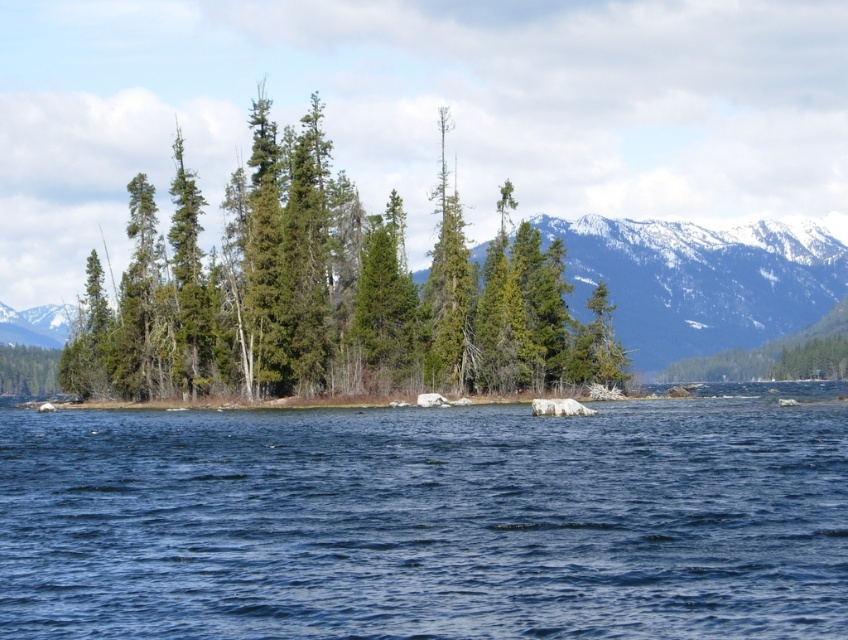
Question: Is snowy rocky mountain at center to the right of snowy white mountain at left from the viewer's perspective?

Choices:
 (A) no
 (B) yes

Answer: (B)

Question: Is blue liquid water at center to the right of green matte trees at center from the viewer's perspective?

Choices:
 (A) yes
 (B) no

Answer: (A)

Question: Estimate the real-world distances between objects in this image. Which object is farther from the green matte tree at left?

Choices:
 (A) green matte trees at center
 (B) snowy white mountain at left
 (C) blue liquid water at center

Answer: (C)

Question: Which object is the closest to the green matte tree at left?

Choices:
 (A) green matte trees at center
 (B) snowy rocky mountain at center

Answer: (A)

Question: Considering the relative positions of blue liquid water at center and green matte trees at center in the image provided, where is blue liquid water at center located with respect to green matte trees at center?

Choices:
 (A) below
 (B) above

Answer: (A)

Question: Among these objects, which one is farthest from the camera?

Choices:
 (A) snowy rocky mountain at center
 (B) blue liquid water at center

Answer: (A)